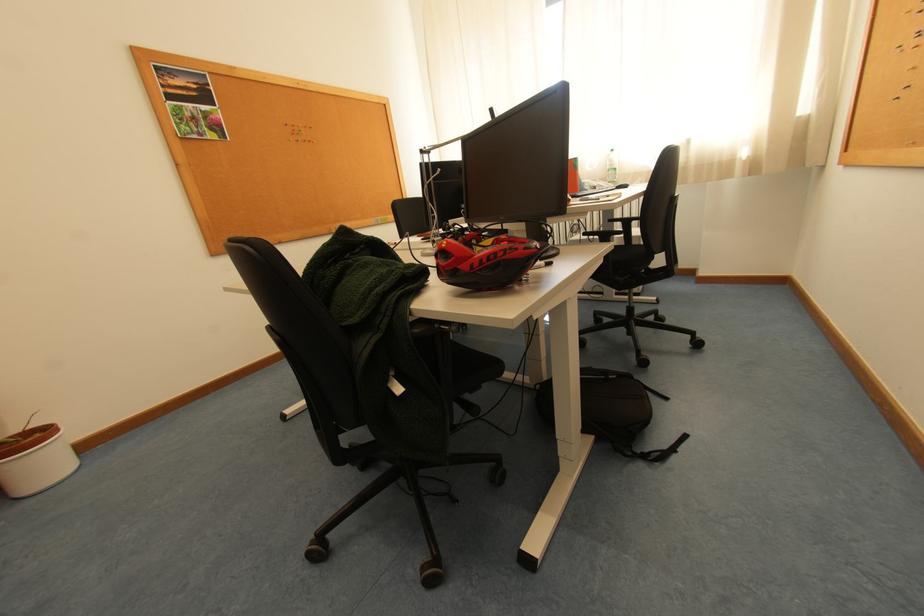
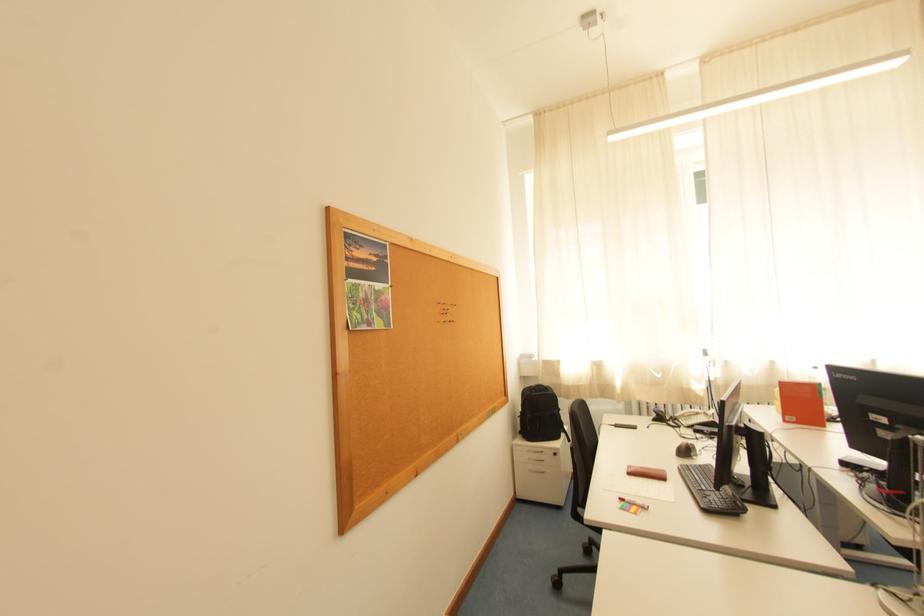
What movement of the cameraman would produce the second image?

The cameraman walked toward left, forward.